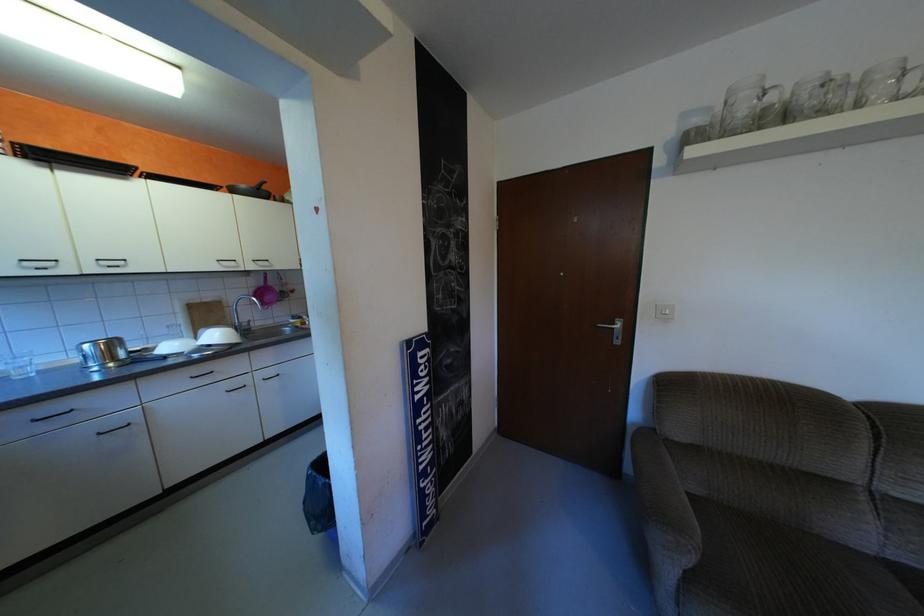
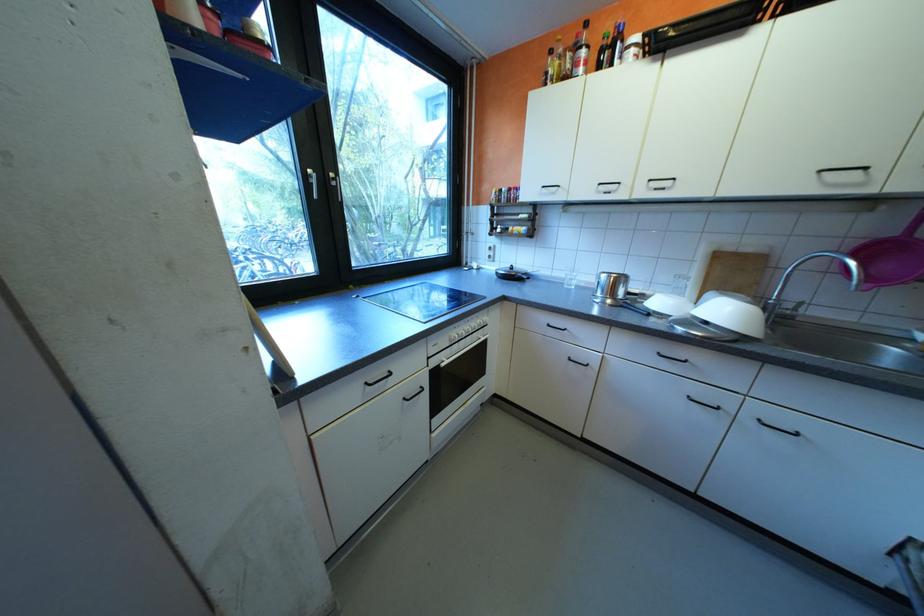
Find the pixel in the second image that matches point 274,283 in the first image.

(906, 231)